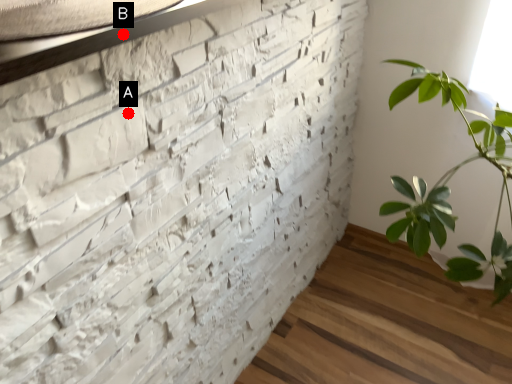
Question: Two points are circled on the image, labeled by A and B beside each circle. Which of the following is the farthest from the observer?

Choices:
 (A) A is further
 (B) B is further

Answer: (A)